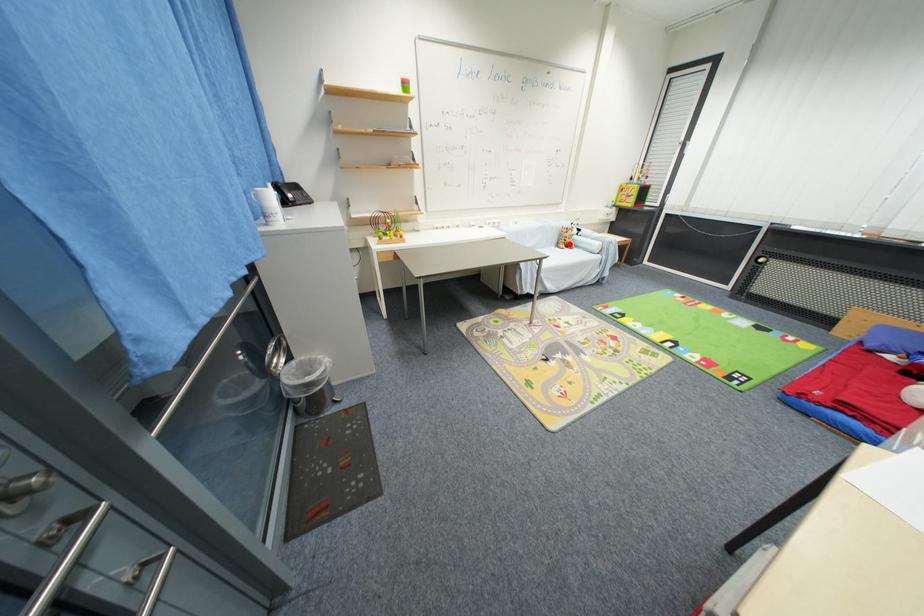
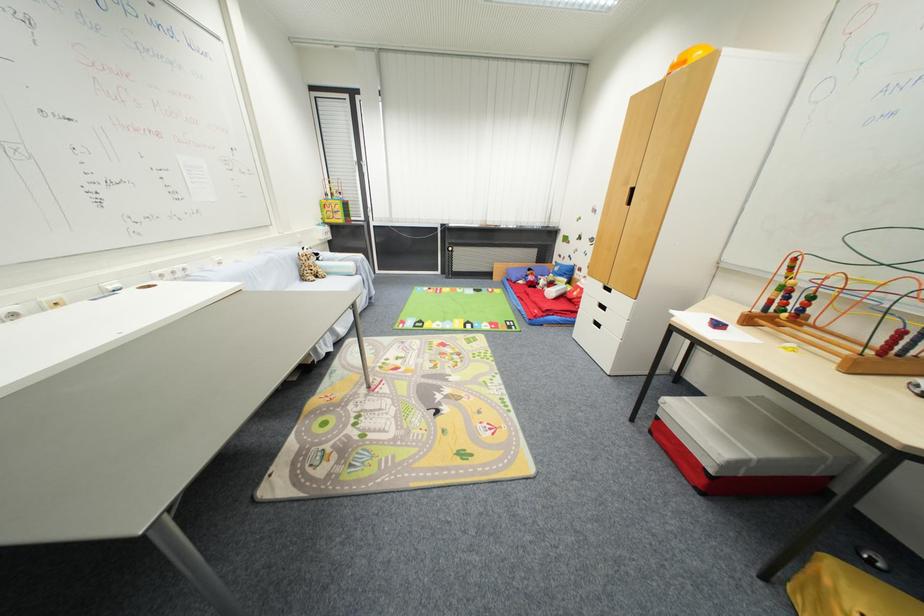
In the second image, find the point that corresponds to the highlighted location in the first image.

(313, 274)